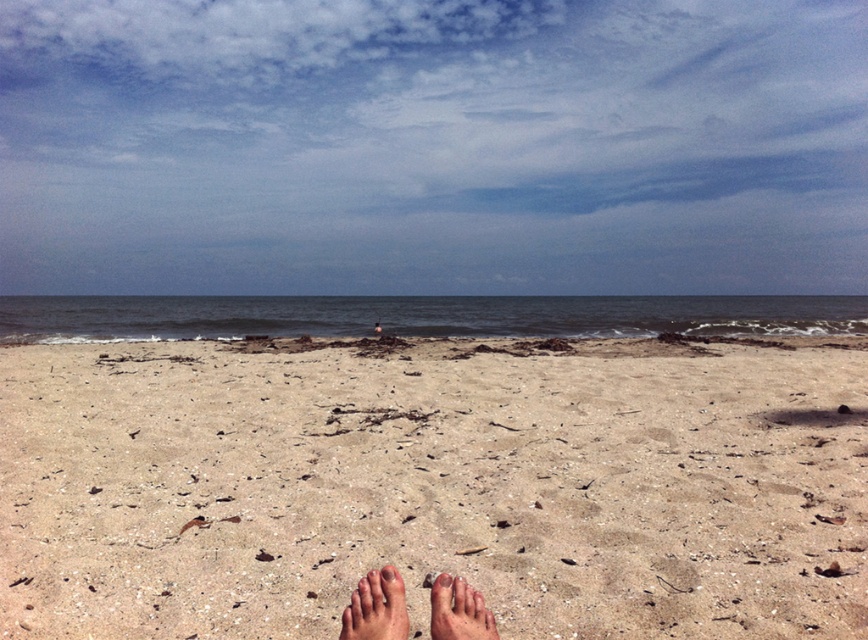
You are standing on the beach and want to place a small flag exactly where the light beige sand at center and light brown skin at lower center meet. Based on the scene, which object is closer to you, and where should you place the flag?

The light beige sand at center is closer to you than the light brown skin at lower center. Therefore, you should place the flag at the boundary where the light beige sand at center meets the light brown skin at lower center, closer to the sand.

You are standing on the beach and want to place a 2.5 meter long wooden board between the light beige sand at center and the skinny bare feet at lower center. Is there enough space to fit the board horizontally between them?

The distance between the light beige sand at center and the skinny bare feet at lower center is 3.47 meters. Since the wooden board is 2.5 meters long, there is sufficient space to place it horizontally between them.

Consider the image. You are standing on the beach and see two points marked on the sand. One is at point coordinates point (380, 634) and the other at point coordinates point (392, 573). Which point is closer to you?

Point (380, 634) is closer to the viewer than point (392, 573).